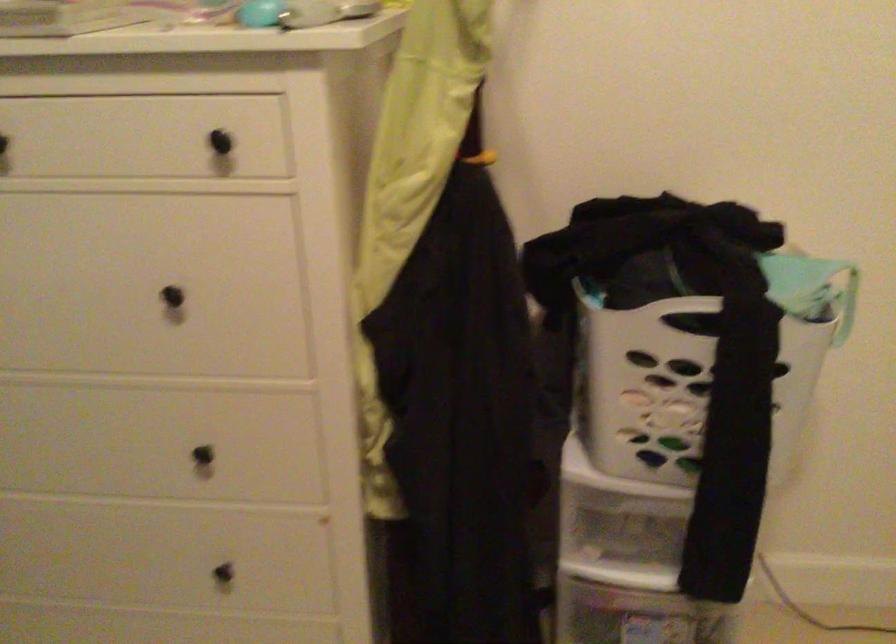
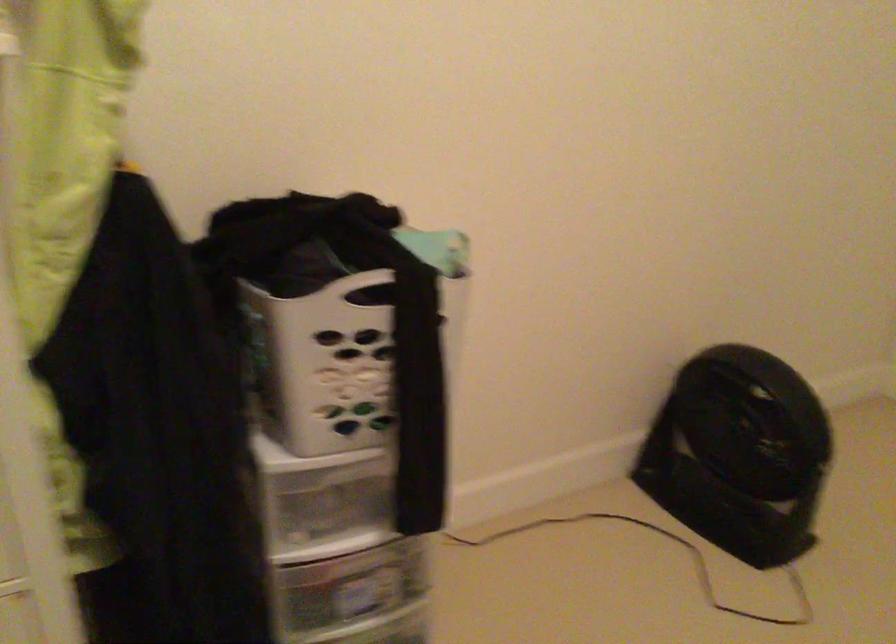
Question: The first image is from the beginning of the video and the second image is from the end. How did the camera likely rotate when shooting the video?

Choices:
 (A) Left
 (B) Right
 (C) Up
 (D) Down

Answer: (B)